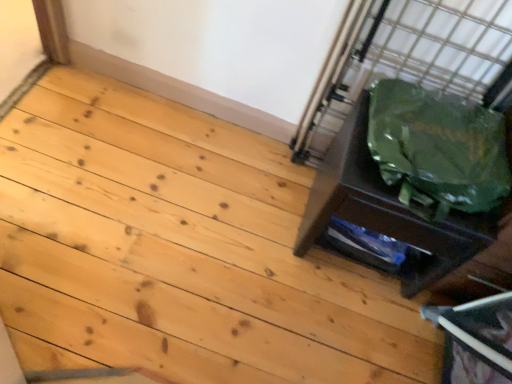
What do you see at coordinates (437, 149) in the screenshot? I see `green plastic bag at right` at bounding box center [437, 149].

This screenshot has height=384, width=512. Find the location of `green plastic bag at right`. green plastic bag at right is located at coordinates (437, 149).

Is green fabric bag at right positioned with its back to natural wood floor at lower right?

That's not correct — green fabric bag at right is not looking away from natural wood floor at lower right.

Is green fabric bag at right situated inside natural wood floor at lower right or outside?

green fabric bag at right cannot be found inside natural wood floor at lower right.

Would you consider green fabric bag at right to be distant from natural wood floor at lower right?

Actually, green fabric bag at right and natural wood floor at lower right are a little close together.

Is green fabric bag at right shorter than natural wood floor at lower right?

No, green fabric bag at right is not shorter than natural wood floor at lower right.

Looking at this image, from the image's perspective, is green plastic bag at right above or below green fabric bag at right?

From the image's perspective, green plastic bag at right appears above green fabric bag at right.

How different are the orientations of green plastic bag at right and green fabric bag at right in degrees?

The angular difference between green plastic bag at right and green fabric bag at right is 2.42 degrees.

At what (x,y) coordinates should I click in order to perform the action: click on garbage above the green fabric bag at right (from a real-world perspective). Please return your answer as a coordinate pair (x, y). Looking at the image, I should click on (437, 149).

Is green fabric bag at right next to green plastic bag at right and touching it?

green fabric bag at right and green plastic bag at right are clearly separated.

Locate an element on the screen. furniture located underneath the green plastic bag at right (from a real-world perspective) is located at coordinates (404, 220).

Is green fabric bag at right to the left of green plastic bag at right from the viewer's perspective?

Indeed, green fabric bag at right is positioned on the left side of green plastic bag at right.

Looking at this image, from the image's perspective, which one is positioned lower, natural wood floor at lower right or green plastic bag at right?

natural wood floor at lower right.

Which point is more forward, (x=237, y=229) or (x=402, y=92)?

The point (x=402, y=92) is closer.

Would you consider natural wood floor at lower right to be distant from green plastic bag at right?

natural wood floor at lower right is near green plastic bag at right, not far away.

Where is `stairwell on the left of green fabric bag at right`? stairwell on the left of green fabric bag at right is located at coordinates (180, 250).

Can you confirm if natural wood floor at lower right is positioned to the left of green fabric bag at right?

Yes.

Is point (310, 258) closer to viewer compared to point (480, 284)?

No, (310, 258) is further to viewer.

Is natural wood floor at lower right oriented towards green fabric bag at right?

No, natural wood floor at lower right is not facing towards green fabric bag at right.

Is green plastic bag at right positioned far away from natural wood floor at lower right?

That's not correct — green plastic bag at right is a little close to natural wood floor at lower right.

Find the location of a particular element. stairwell beneath the green plastic bag at right (from a real-world perspective) is located at coordinates (180, 250).

Which of these two, green plastic bag at right or natural wood floor at lower right, stands shorter?

Standing shorter between the two is natural wood floor at lower right.

Does green plastic bag at right have a smaller size compared to natural wood floor at lower right?

Yes, green plastic bag at right is smaller than natural wood floor at lower right.

Locate an element on the screen. The height and width of the screenshot is (384, 512). furniture behind the natural wood floor at lower right is located at coordinates (404, 220).

Find the location of `garbage that appears in front of the green fabric bag at right`. garbage that appears in front of the green fabric bag at right is located at coordinates (437, 149).

Based on their spatial positions, is green plastic bag at right or green fabric bag at right closer to natural wood floor at lower right?

Based on the image, green fabric bag at right appears to be nearer to natural wood floor at lower right.

Considering their positions, is natural wood floor at lower right positioned further to green plastic bag at right than green fabric bag at right?

natural wood floor at lower right is positioned further to the anchor green plastic bag at right.

From the image, which object appears to be farther from green fabric bag at right, natural wood floor at lower right or green plastic bag at right?

natural wood floor at lower right is positioned further to the anchor green fabric bag at right.

When comparing their distances from green fabric bag at right, does green plastic bag at right or natural wood floor at lower right seem further?

Based on the image, natural wood floor at lower right appears to be further to green fabric bag at right.

Looking at the image, which one is located closer to green plastic bag at right, green fabric bag at right or natural wood floor at lower right?

green fabric bag at right lies closer to green plastic bag at right than the other object.

When comparing their distances from natural wood floor at lower right, does green fabric bag at right or green plastic bag at right seem further?

green plastic bag at right is further to natural wood floor at lower right.

This screenshot has width=512, height=384. Find the location of `furniture between natural wood floor at lower right and green plastic bag at right`. furniture between natural wood floor at lower right and green plastic bag at right is located at coordinates (404, 220).